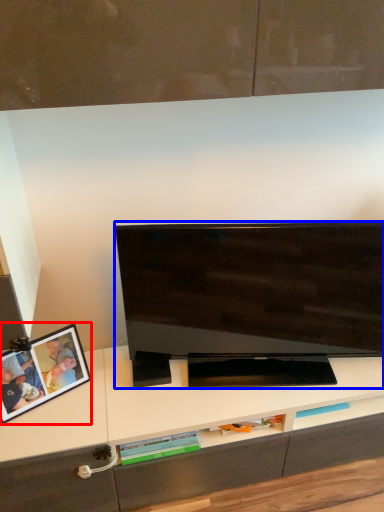
Question: Which point is closer to the camera, picture frame (highlighted by a red box) or television (highlighted by a blue box)?

Choices:
 (A) picture frame
 (B) television

Answer: (B)